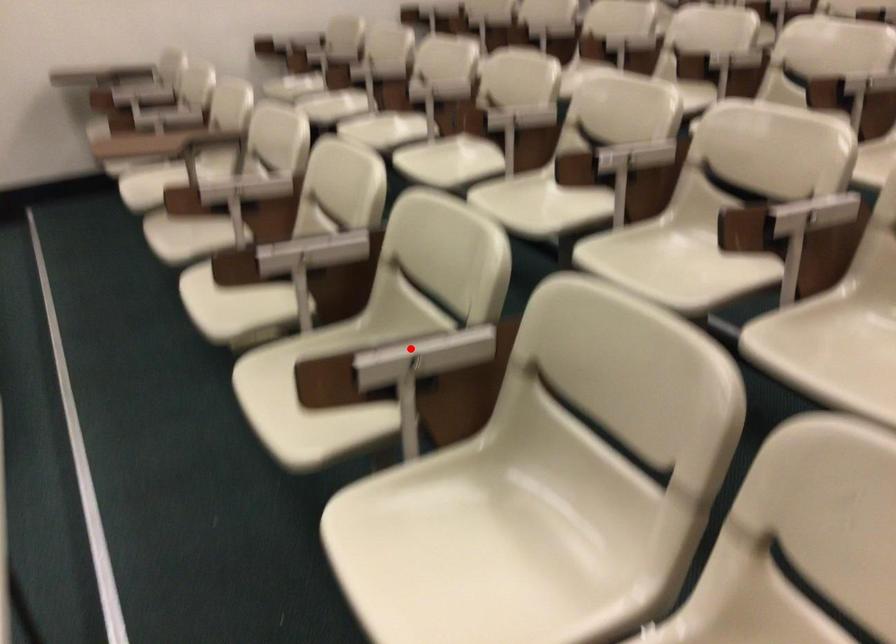
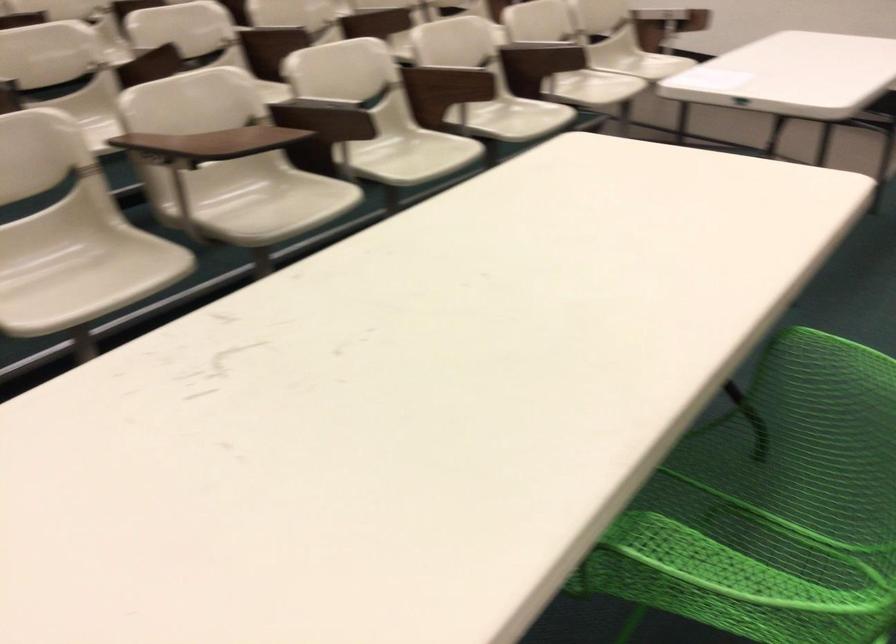
Question: I am providing you with two images of the same scene from different viewpoints. In image1, a red point is highlighted. Considering the same 3D point in image2, which of the following is correct?

Choices:
 (A) It is closer
 (B) It is farther

Answer: (B)